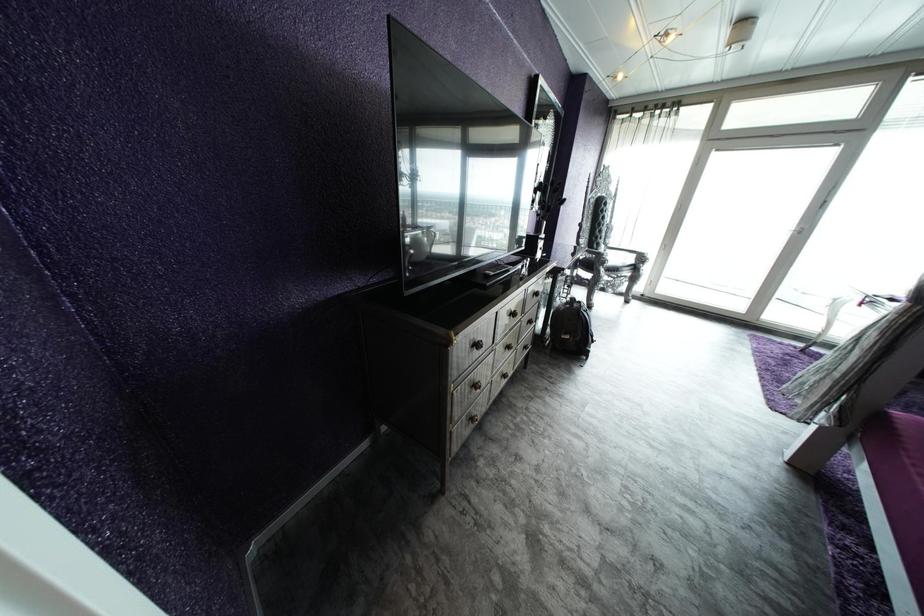
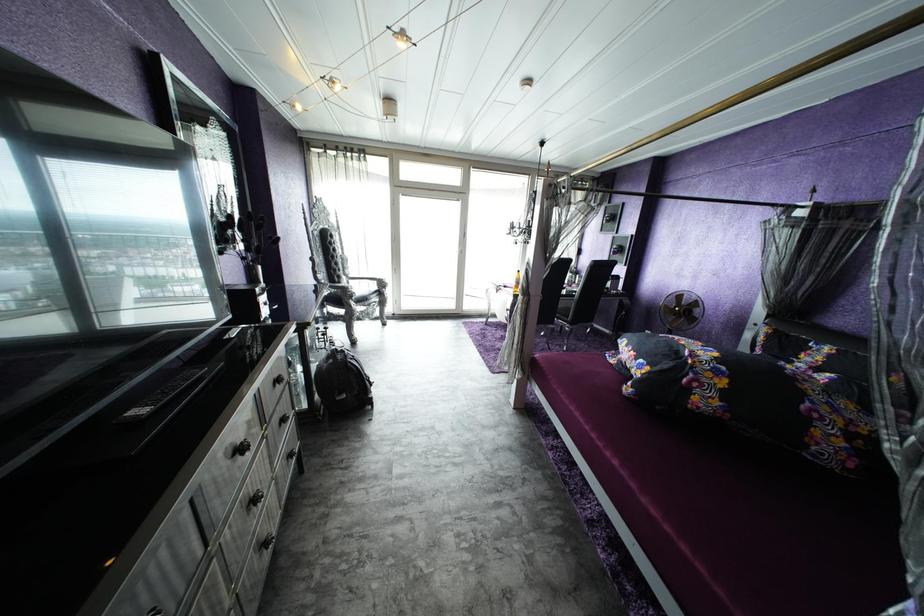
Question: How did the camera likely rotate?

Choices:
 (A) Left
 (B) Right
 (C) Up
 (D) Down

Answer: (B)